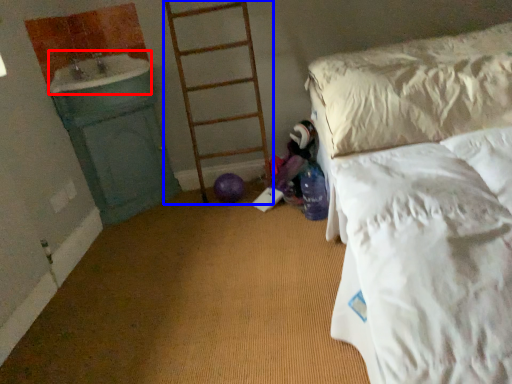
Question: Which of the following is the farthest to the observer, sink (highlighted by a red box) or ladder (highlighted by a blue box)?

Choices:
 (A) sink
 (B) ladder

Answer: (B)